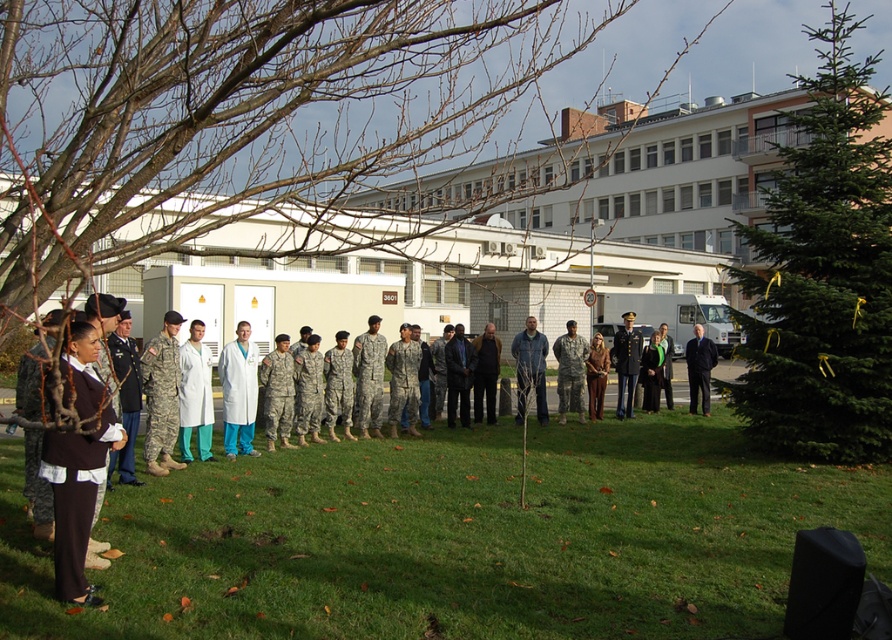
Does point (106, 444) lie in front of point (201, 429)?

Yes, point (106, 444) is in front of point (201, 429).

Is point (55, 484) farther from viewer compared to point (197, 416)?

No, it is not.

Is point (45, 456) positioned before point (180, 438)?

That is True.

Identify the location of brown wool sweater at lower left. (77, 464).

Between green textured evergreen tree at right and camouflage uniform at center, which one has more height?

green textured evergreen tree at right is taller.

Is point (756, 288) closer to viewer compared to point (563, 404)?

Yes, point (756, 288) is in front of point (563, 404).

Locate an element on the screen. Image resolution: width=892 pixels, height=640 pixels. green textured evergreen tree at right is located at coordinates (823, 273).

Who is higher up, brown wool sweater at lower left or brown leather jacket at center?

brown wool sweater at lower left is higher up.

Identify the location of brown wool sweater at lower left. (77, 464).